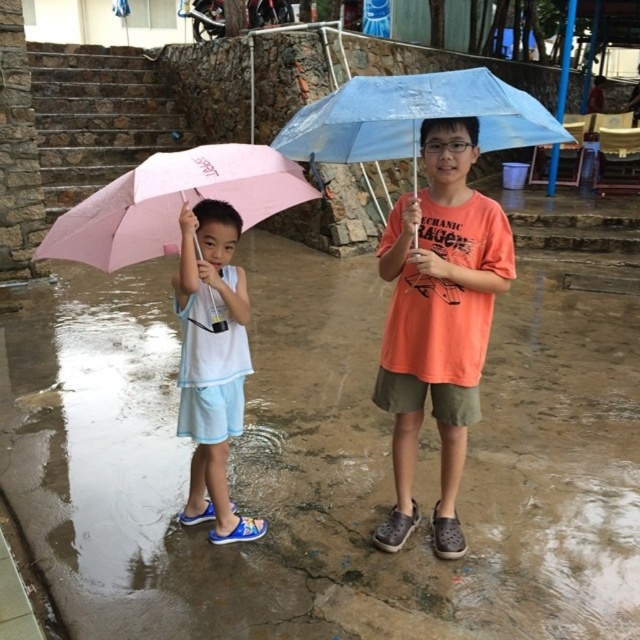
The width and height of the screenshot is (640, 640). In order to click on pink matte umbrella at left in this screenshot , I will do `click(172, 202)`.

Does pink matte umbrella at left have a lesser height compared to transparent blue umbrella at center?

In fact, pink matte umbrella at left may be taller than transparent blue umbrella at center.

This screenshot has width=640, height=640. I want to click on pink matte umbrella at left, so click(x=172, y=202).

Can you confirm if pink fabric umbrella at left is positioned above pink matte umbrella at left?

Actually, pink fabric umbrella at left is below pink matte umbrella at left.

Between pink fabric umbrella at left and pink matte umbrella at left, which one is positioned lower?

pink fabric umbrella at left is below.

Locate an element on the screen. The width and height of the screenshot is (640, 640). pink fabric umbrella at left is located at coordinates click(x=326, y=464).

How far apart are orange matte t-shirt at center and pink matte umbrella at left?

orange matte t-shirt at center and pink matte umbrella at left are 31.82 inches apart from each other.

Does point (461, 337) come farther from viewer compared to point (113, 208)?

Yes, point (461, 337) is behind point (113, 208).

Find the location of a particular element. The image size is (640, 640). orange matte t-shirt at center is located at coordinates (438, 321).